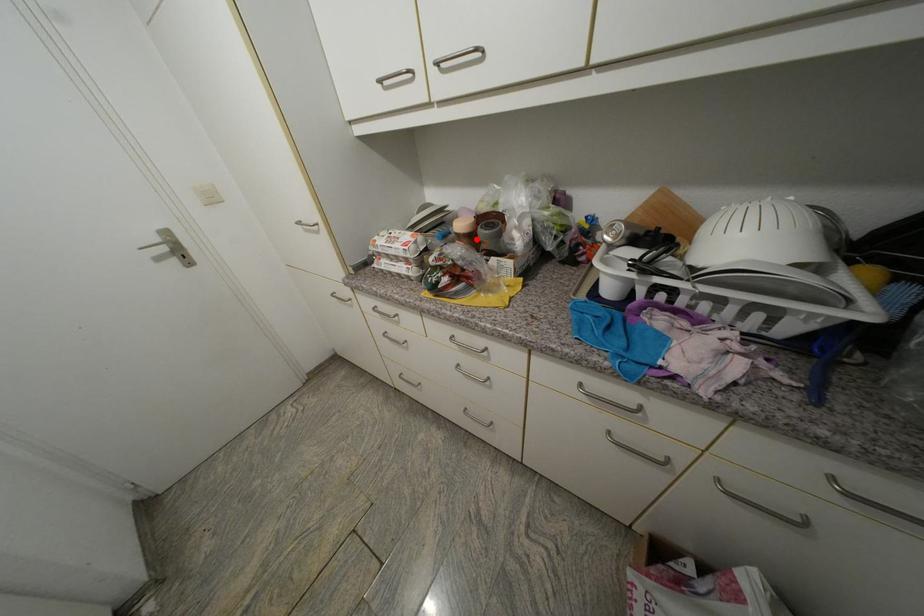
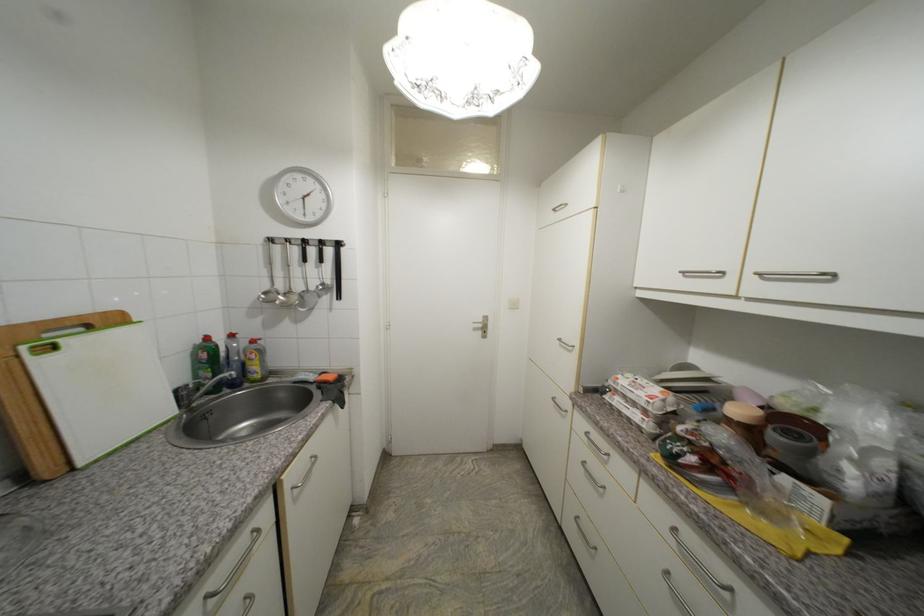
Question: I am providing you with two images of the same scene from different viewpoints. A red point is marked on the first image. At the location where the point appears in image 1, is it still visible in image 2?

Choices:
 (A) Yes
 (B) No

Answer: (A)